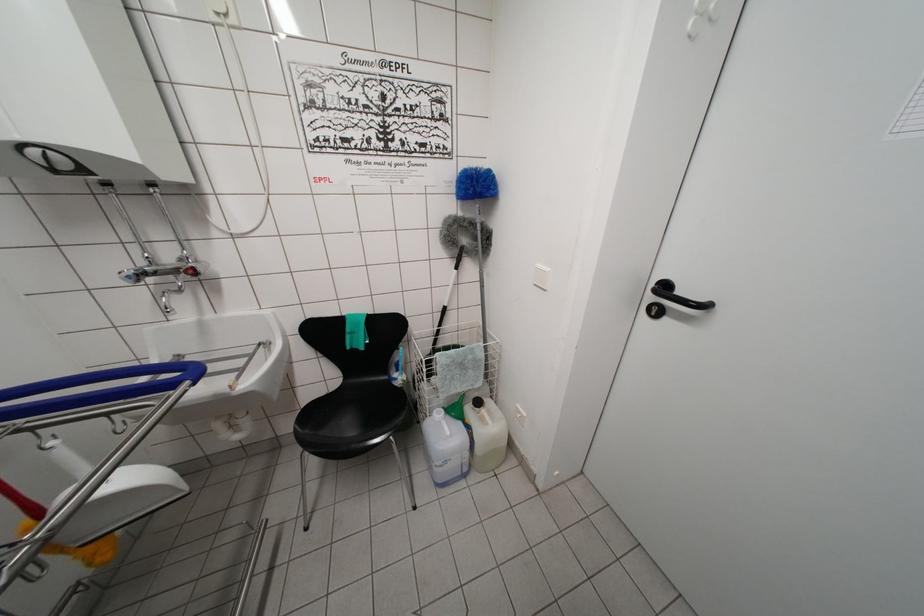
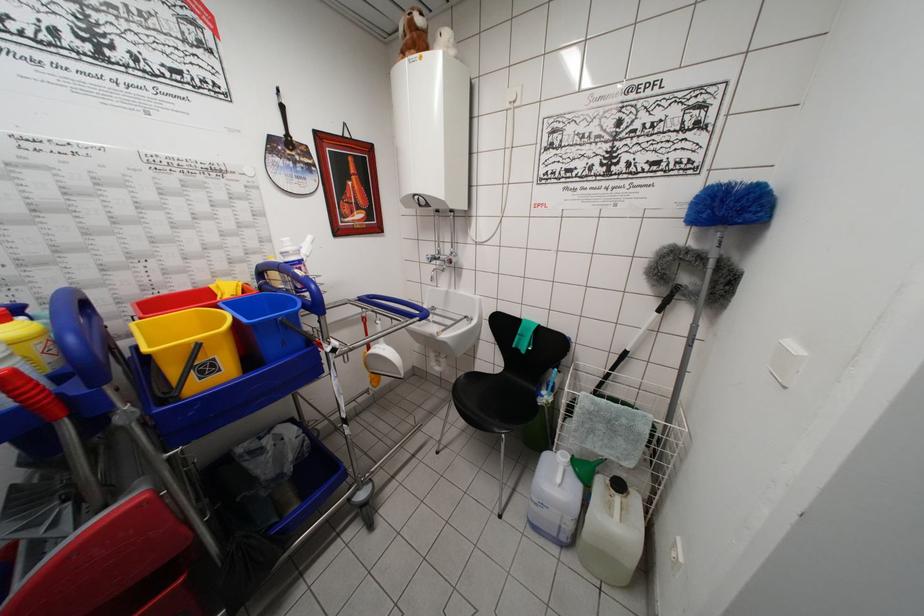
Where in the second image is the point corresponding to (131,282) from the first image?

(432, 262)